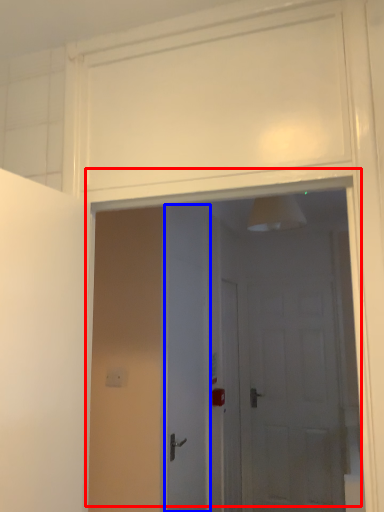
Question: Which object is closer to the camera taking this photo, door (highlighted by a red box) or door (highlighted by a blue box)?

Choices:
 (A) door
 (B) door

Answer: (A)